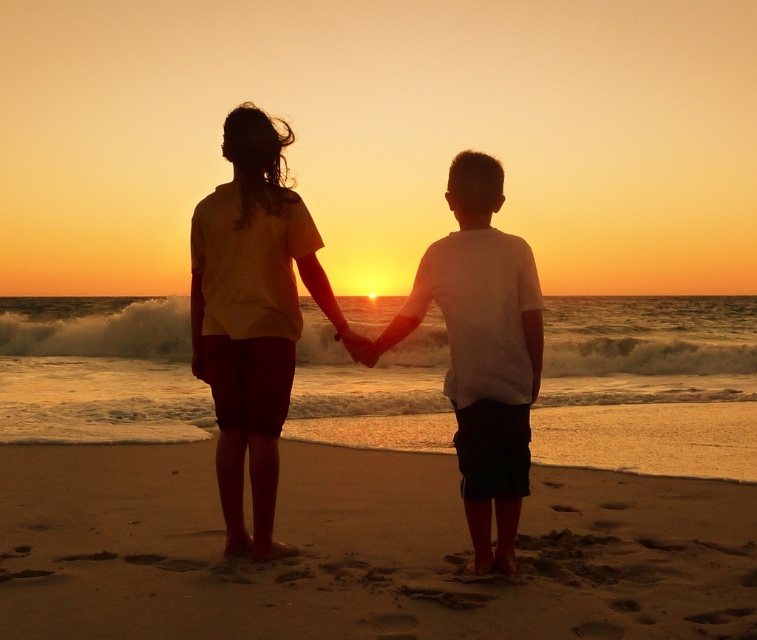
You are a photographer trying to capture the two children in the sunset scene. You notice their clothing items labeled as silhouette clothing at center and white matte shirt at center. Which clothing item appears larger in the photo?

The silhouette clothing at center appears larger than the white matte shirt at center in the photo.

You are a photographer trying to capture the sunset scene. You notice the brown sandy beach at center and the white matte shirt at center in your frame. Which object takes up more area in the image?

The white matte shirt at center occupies more space than the brown sandy beach at center.

You are a photographer trying to capture the sunset scene. You notice the point at the center of the image marked by coordinates point [251,316]. What object is located at this point?

The point [251,316] indicates the location of the matte yellow shirt at center.